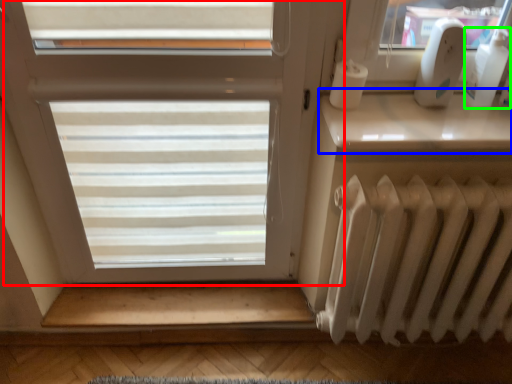
Question: Which object is positioned farthest from window (highlighted by a red box)? Select from window sill (highlighted by a blue box) and toiletry (highlighted by a green box).

Choices:
 (A) window sill
 (B) toiletry

Answer: (B)